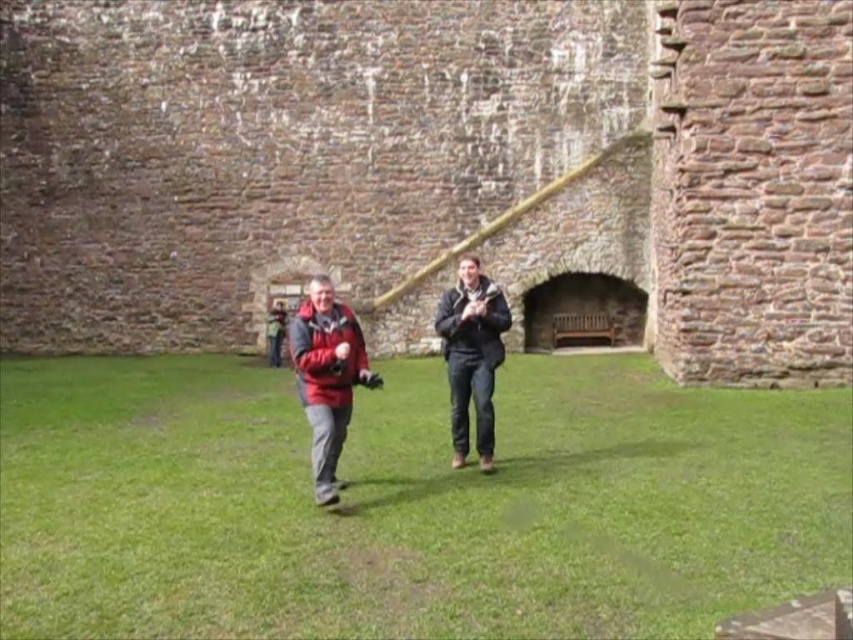
Question: Is brick wall at center to the left of green grass at center from the viewer's perspective?

Choices:
 (A) no
 (B) yes

Answer: (B)

Question: Among these points, which one is farthest from the camera?

Choices:
 (A) (785, 378)
 (B) (469, 284)

Answer: (A)

Question: Is brick wall at center to the left of matte red jacket at center from the viewer's perspective?

Choices:
 (A) no
 (B) yes

Answer: (A)

Question: Can you confirm if green grass at center is positioned above matte red jacket at center?

Choices:
 (A) no
 (B) yes

Answer: (A)

Question: Which object is the closest to the matte red jacket at center?

Choices:
 (A) matte black jacket at center
 (B) green grass at center
 (C) brick wall at center

Answer: (A)

Question: Which point is closer to the camera taking this photo?

Choices:
 (A) (479, 294)
 (B) (706, 509)
 (C) (492, 320)

Answer: (B)